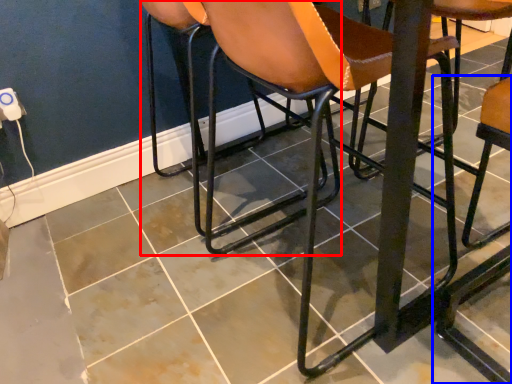
Question: Which object appears closest to the camera in this image, chair (highlighted by a red box) or chair (highlighted by a blue box)?

Choices:
 (A) chair
 (B) chair

Answer: (B)